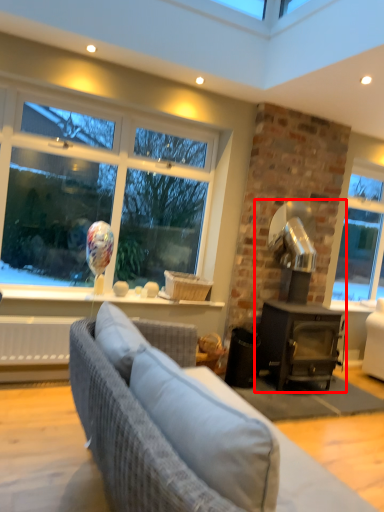
Question: Considering the relative positions of fireplace (annotated by the red box) and studio couch in the image provided, where is fireplace (annotated by the red box) located with respect to the staircase?

Choices:
 (A) right
 (B) left

Answer: (A)